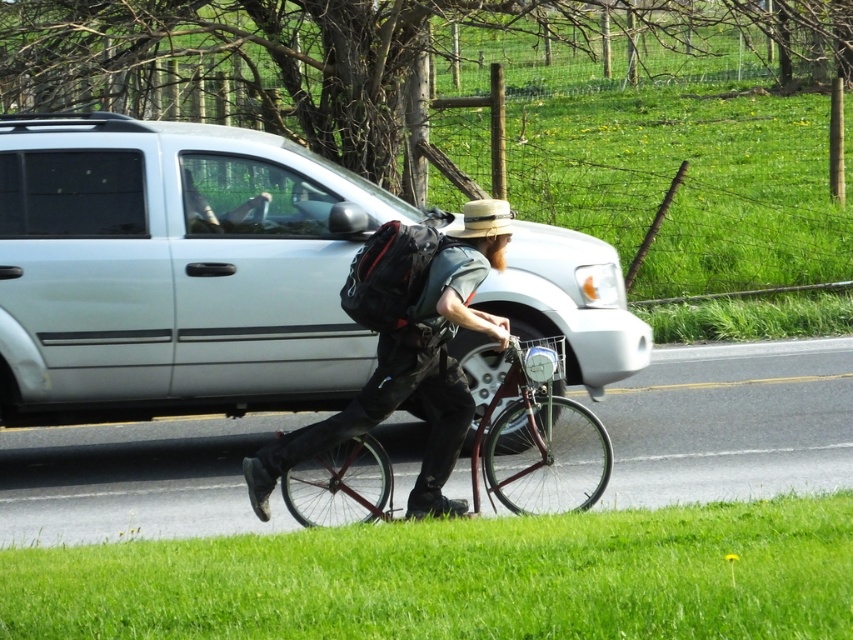
Can you confirm if matte black backpack at center is wider than metallic red bicycle at center?

Yes, matte black backpack at center is wider than metallic red bicycle at center.

Does matte black backpack at center appear over metallic red bicycle at center?

Correct, matte black backpack at center is located above metallic red bicycle at center.

In order to click on matte black backpack at center in this screenshot , I will do click(x=407, y=380).

Is silver metallic truck at center-left wider than metallic red bicycle at center?

Yes, silver metallic truck at center-left is wider than metallic red bicycle at center.

Is silver metallic truck at center-left positioned behind metallic red bicycle at center?

Yes, it is behind metallic red bicycle at center.

Locate an element on the screen. silver metallic truck at center-left is located at coordinates (175, 269).

Can you confirm if matte black backpack at center is wider than natural straw hat at center?

Yes, matte black backpack at center is wider than natural straw hat at center.

Does point (436, 404) come farther from viewer compared to point (485, 211)?

Yes, it is.

This screenshot has height=640, width=853. Identify the location of matte black backpack at center. (407, 380).